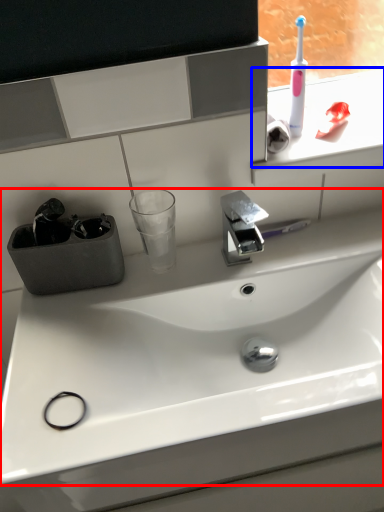
Question: Which object appears farthest to the camera in this image, sink (highlighted by a red box) or window sill (highlighted by a blue box)?

Choices:
 (A) sink
 (B) window sill

Answer: (B)